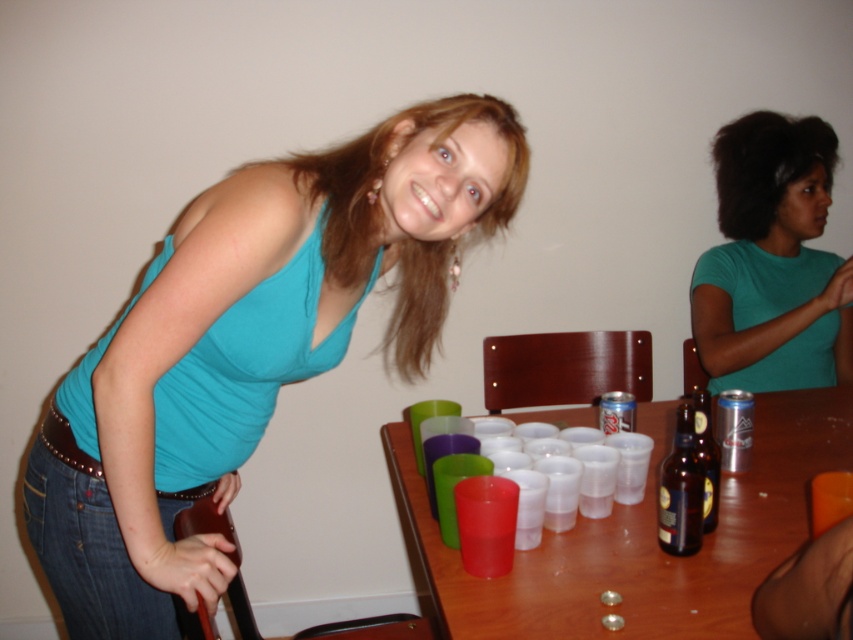
Which is above, teal fabric tank top at upper left or brown glass bottle at table right?

teal fabric tank top at upper left is above.

Does teal fabric tank top at upper left appear on the left side of brown glass bottle at table right?

Indeed, teal fabric tank top at upper left is positioned on the left side of brown glass bottle at table right.

Is point (181, 268) more distant than point (704, 406)?

That is False.

The width and height of the screenshot is (853, 640). What are the coordinates of `teal fabric tank top at upper left` in the screenshot? It's located at (248, 348).

Is green matte shirt at upper right closer to the viewer compared to brown glass bottle at table right?

That is False.

What do you see at coordinates (772, 260) in the screenshot? I see `green matte shirt at upper right` at bounding box center [772, 260].

Does point (811, 344) come closer to viewer compared to point (695, 388)?

No, (811, 344) is further to viewer.

Where is `green matte shirt at upper right`? green matte shirt at upper right is located at coordinates (772, 260).

Based on the photo, between teal fabric tank top at upper left and brown glass bottle at lower right, which one is positioned higher?

teal fabric tank top at upper left is above.

Is teal fabric tank top at upper left positioned at the back of brown glass bottle at lower right?

No, it is not.

The image size is (853, 640). What do you see at coordinates (248, 348) in the screenshot? I see `teal fabric tank top at upper left` at bounding box center [248, 348].

At what (x,y) coordinates should I click in order to perform the action: click on teal fabric tank top at upper left. Please return your answer as a coordinate pair (x, y). This screenshot has height=640, width=853. Looking at the image, I should click on point(248,348).